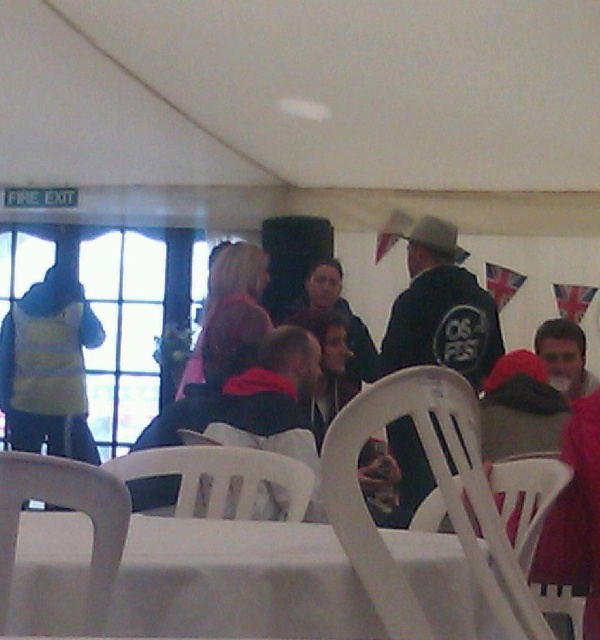
From the picture: You are attending an event and want to sit down. You see a white plastic chair at center and a matte pink sweater at center. Which object is positioned to the right from your perspective?

The white plastic chair at center is to the right of the matte pink sweater at center, so the chair is positioned to the right.

You are planning to sit on the white plastic chair at center while wearing the matte pink sweater at center. Will the sweater fit comfortably on the chair without bunching up too much?

The white plastic chair at center has a width that is less than the matte pink sweater at center, so the sweater might bunch up when seated because the chair is narrower than the sweater.